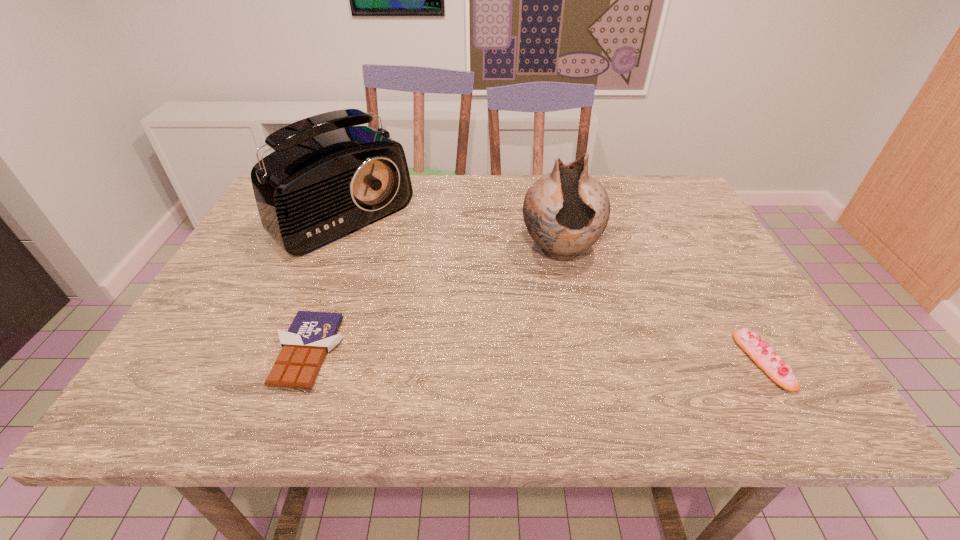
In order to click on vacant area situated from the spout of the third object from left to right in this screenshot , I will do `click(572, 318)`.

Locate an element on the screen. This screenshot has height=540, width=960. vacant space located 0.190m from the spout of the third object from left to right is located at coordinates (576, 340).

The image size is (960, 540). I want to click on object located at the far edge, so click(x=327, y=178).

Identify the location of chocolate bar situated at the near edge. The image size is (960, 540). (311, 335).

The image size is (960, 540). Find the location of `eclair that is positioned at the near edge`. eclair that is positioned at the near edge is located at coordinates pos(759,351).

Where is `object that is at the left edge`? object that is at the left edge is located at coordinates (327, 178).

Locate an element on the screen. The image size is (960, 540). object at the right edge is located at coordinates (759, 351).

Where is `object that is positioned at the far left corner`? object that is positioned at the far left corner is located at coordinates (327, 178).

Locate an element on the screen. Image resolution: width=960 pixels, height=540 pixels. object that is positioned at the near right corner is located at coordinates (759, 351).

Find the location of a particular element. vacant space at the far edge of the desktop is located at coordinates (518, 195).